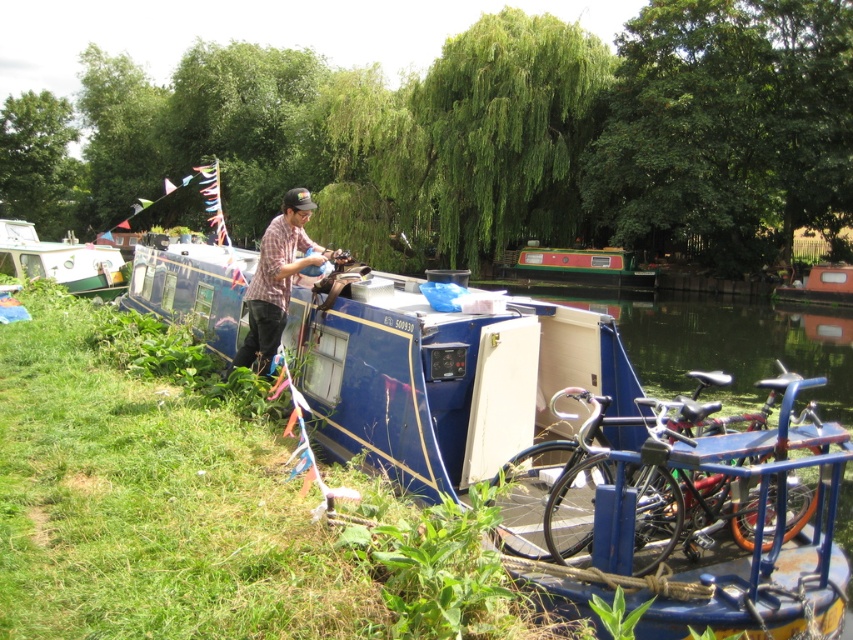
Question: Among these points, which one is farthest from the camera?

Choices:
 (A) (769, 388)
 (B) (268, 324)

Answer: (B)

Question: Which object is farther from the camera taking this photo?

Choices:
 (A) plaid shirt at center
 (B) white wooden houseboat at left
 (C) green glossy narrowboat at center
 (D) shiny metallic bicycles at lower right

Answer: (C)

Question: Which is farther from the orange matte boat at center?

Choices:
 (A) white wooden houseboat at left
 (B) green glossy narrowboat at center
 (C) plaid shirt at center
 (D) shiny metallic bicycles at lower right

Answer: (D)

Question: Does plaid shirt at center appear on the left side of green glossy narrowboat at center?

Choices:
 (A) no
 (B) yes

Answer: (B)

Question: In this image, where is plaid shirt at center located relative to orange matte boat at center?

Choices:
 (A) right
 (B) left

Answer: (B)

Question: Observing the image, what is the correct spatial positioning of shiny metallic bicycles at lower right in reference to orange matte boat at center?

Choices:
 (A) right
 (B) left

Answer: (B)